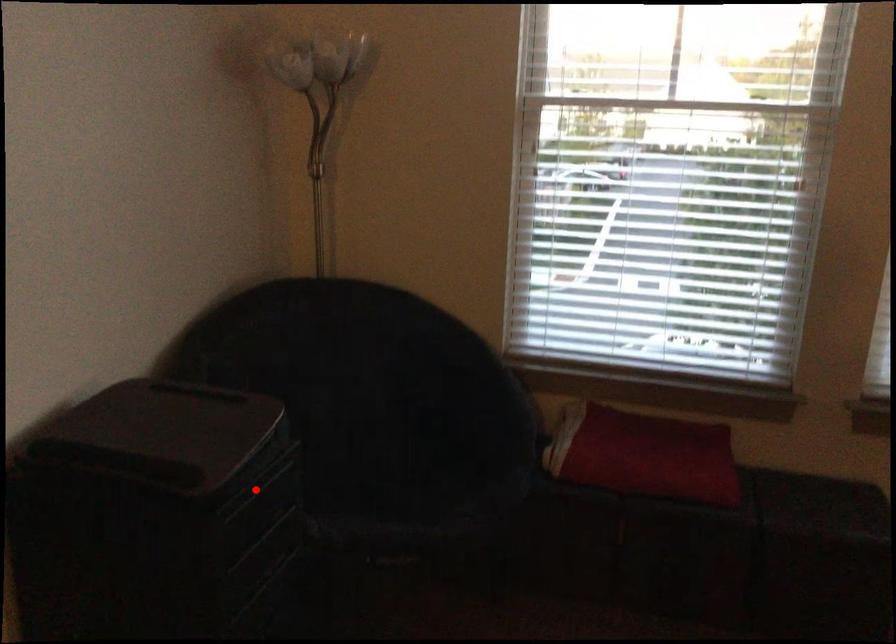
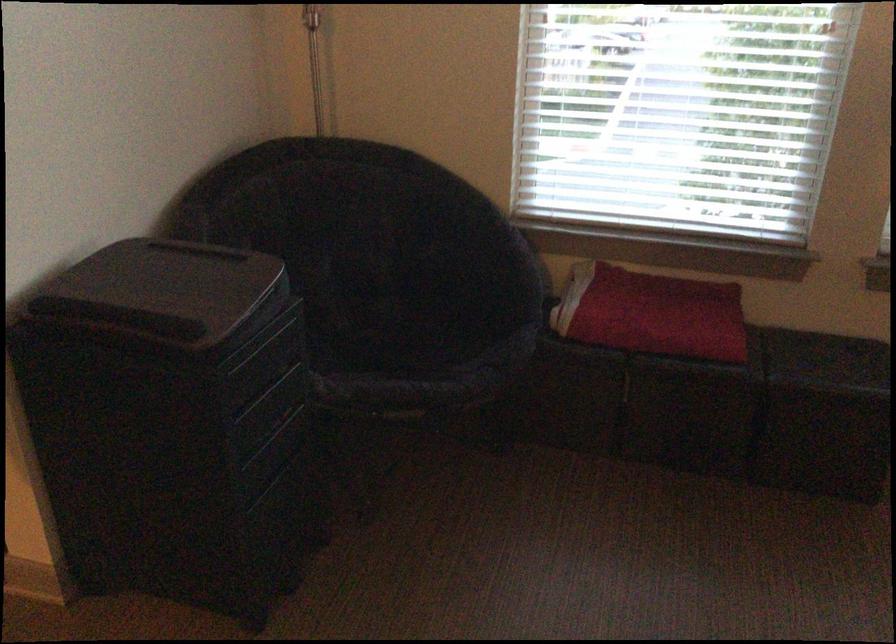
Locate, in the second image, the point that corresponds to the highlighted location in the first image.

(260, 346)